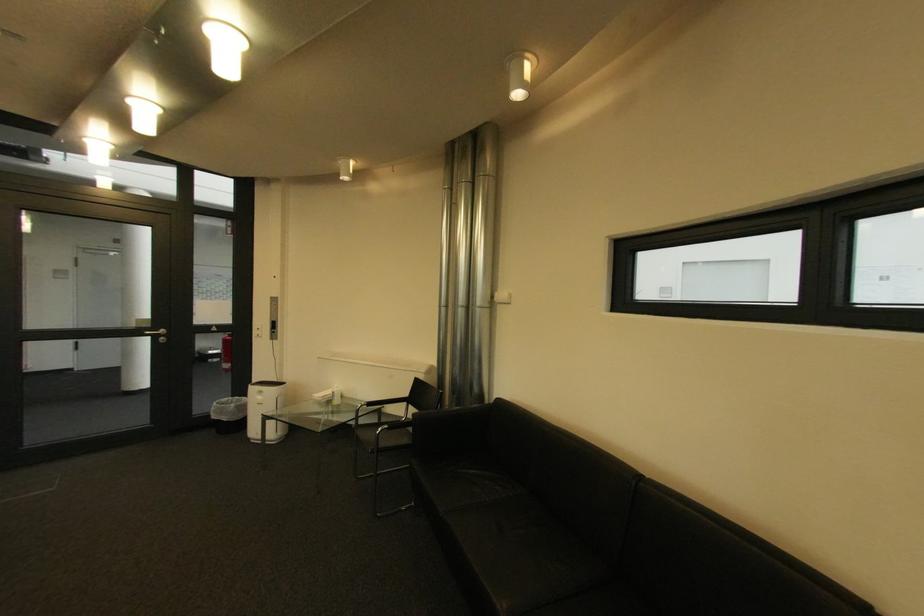
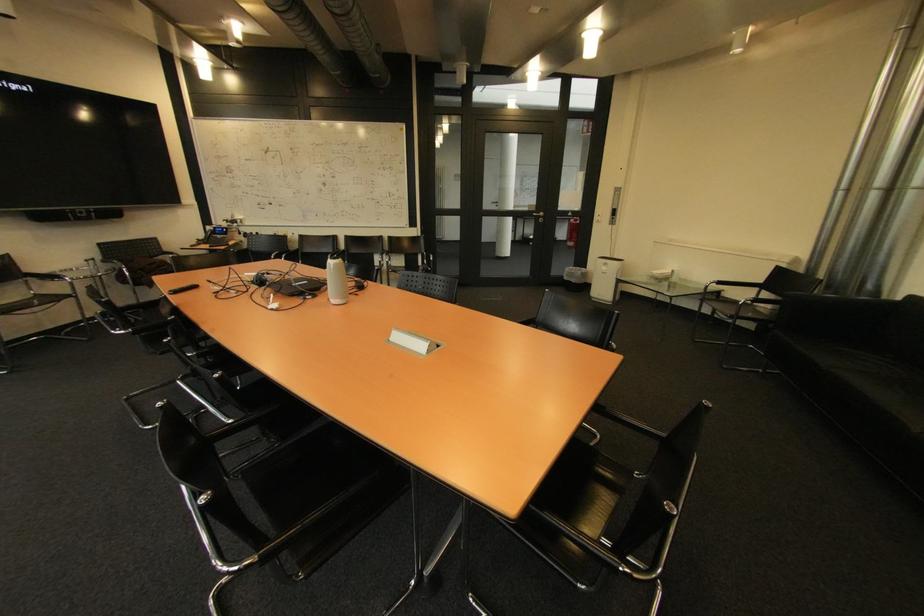
Where in the second image is the point corresponding to [494,402] from the first image?

(893, 300)